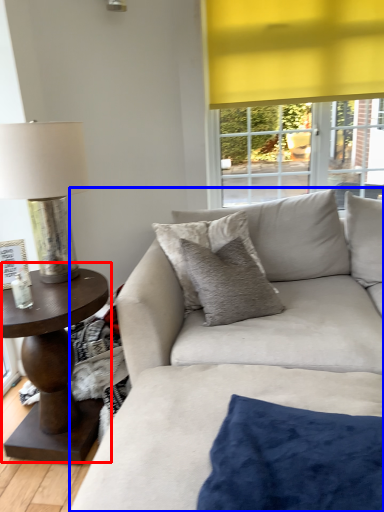
Question: Which object appears closest to the camera in this image, coffee table (highlighted by a red box) or studio couch (highlighted by a blue box)?

Choices:
 (A) coffee table
 (B) studio couch

Answer: (B)